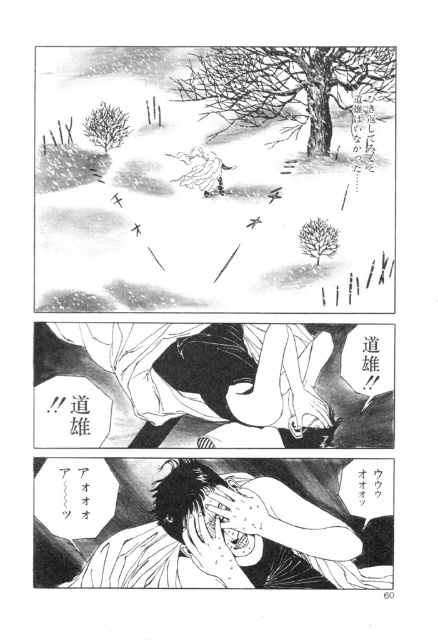
In the top panel of the manga scene, there is a figure with smooth black hair at center and a white paper at lower center. How far apart are these two elements?

The smooth black hair at center is 5.74 inches from the white paper at lower center.